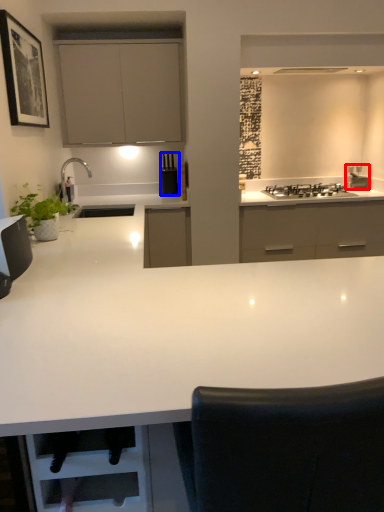
Question: Which object appears farthest to the camera in this image, appliance (highlighted by a red box) or kitchen appliance (highlighted by a blue box)?

Choices:
 (A) appliance
 (B) kitchen appliance

Answer: (A)